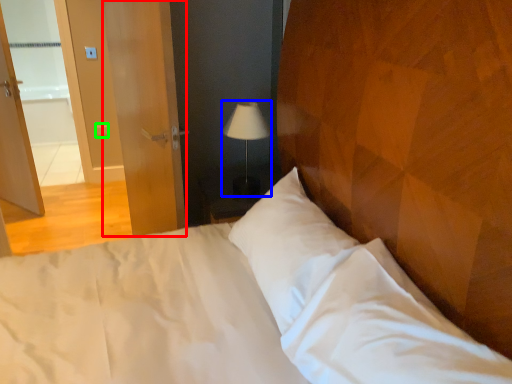
Question: Estimate the real-world distances between objects in this image. Which object is farther from screen door (highlighted by a red box), lamp (highlighted by a blue box) or light switch (highlighted by a green box)?

Choices:
 (A) lamp
 (B) light switch

Answer: (B)